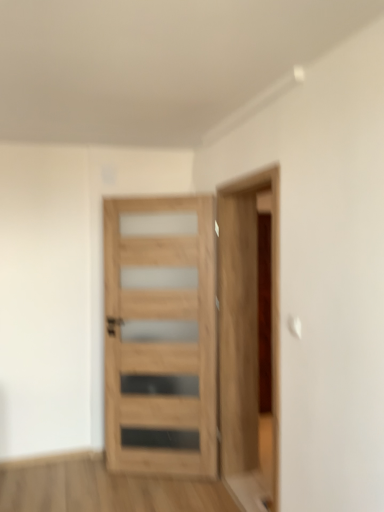
Question: Considering the relative sizes of wooden door at right and natural wood door at center in the image provided, is wooden door at right smaller than natural wood door at center?

Choices:
 (A) no
 (B) yes

Answer: (A)

Question: Is wooden door at right facing towards natural wood door at center?

Choices:
 (A) yes
 (B) no

Answer: (B)

Question: Does wooden door at right have a greater width compared to natural wood door at center?

Choices:
 (A) yes
 (B) no

Answer: (A)

Question: Can you confirm if wooden door at right is shorter than natural wood door at center?

Choices:
 (A) yes
 (B) no

Answer: (B)

Question: Is wooden door at right turned away from natural wood door at center?

Choices:
 (A) no
 (B) yes

Answer: (A)

Question: Is wooden door at right outside natural wood door at center?

Choices:
 (A) no
 (B) yes

Answer: (B)

Question: Is natural wood door at center positioned far away from wooden door at right?

Choices:
 (A) yes
 (B) no

Answer: (B)

Question: From the image's perspective, is natural wood door at center on top of wooden door at right?

Choices:
 (A) no
 (B) yes

Answer: (A)

Question: Is natural wood door at center at the right side of wooden door at right?

Choices:
 (A) no
 (B) yes

Answer: (A)

Question: Is natural wood door at center further to camera compared to wooden door at right?

Choices:
 (A) no
 (B) yes

Answer: (B)

Question: Can you confirm if natural wood door at center is smaller than wooden door at right?

Choices:
 (A) no
 (B) yes

Answer: (B)

Question: From a real-world perspective, is natural wood door at center positioned over wooden door at right based on gravity?

Choices:
 (A) no
 (B) yes

Answer: (A)

Question: Considering the positions of point (271, 343) and point (162, 243), is point (271, 343) closer or farther from the camera than point (162, 243)?

Choices:
 (A) closer
 (B) farther

Answer: (A)